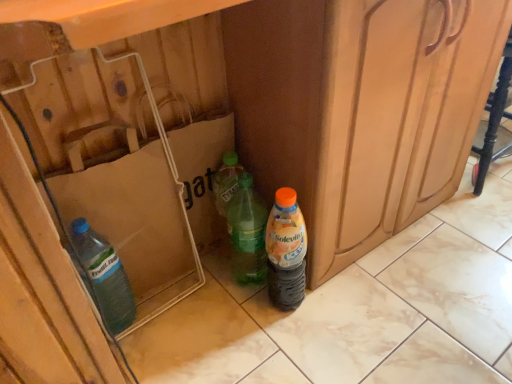
What is the approximate width of orange matte plastic bottle at lower right, marked as the first bottle in a right-to-left arrangement?

orange matte plastic bottle at lower right, marked as the first bottle in a right-to-left arrangement, is 3.39 inches in width.

Where is `orange matte plastic bottle at lower right, which is the second bottle from left to right`? orange matte plastic bottle at lower right, which is the second bottle from left to right is located at coordinates (286, 251).

This screenshot has height=384, width=512. What do you see at coordinates (286, 251) in the screenshot?
I see `orange matte plastic bottle at lower right, which is the second bottle from left to right` at bounding box center [286, 251].

What do you see at coordinates (247, 232) in the screenshot? This screenshot has height=384, width=512. I see `green translucent bottle at center, the 1th bottle from the left` at bounding box center [247, 232].

Find the location of `green translucent bottle at center, the 1th bottle from the left`. green translucent bottle at center, the 1th bottle from the left is located at coordinates (247, 232).

You are a GUI agent. You are given a task and a screenshot of the screen. Output one action in this format:
    pyautogui.click(x=<x>, y=<y>)
    Task: Click on the orange matte plastic bottle at lower right, marked as the first bottle in a right-to-left arrangement
    The width and height of the screenshot is (512, 384).
    Given the screenshot: What is the action you would take?
    pyautogui.click(x=286, y=251)

Does orange matte plastic bottle at lower right, marked as the first bottle in a right-to-left arrangement, appear on the right side of green translucent bottle at center, positioned as the 2th bottle in right-to-left order?

Correct, you'll find orange matte plastic bottle at lower right, marked as the first bottle in a right-to-left arrangement, to the right of green translucent bottle at center, positioned as the 2th bottle in right-to-left order.

Is orange matte plastic bottle at lower right, which is the second bottle from left to right, further to camera compared to green translucent bottle at center, positioned as the 2th bottle in right-to-left order?

No.

Which is closer, (295, 206) or (251, 278)?

Point (295, 206)

From the image's perspective, which one is positioned lower, orange matte plastic bottle at lower right, which is the second bottle from left to right, or green translucent bottle at center, positioned as the 2th bottle in right-to-left order?

orange matte plastic bottle at lower right, which is the second bottle from left to right, from the image's perspective.

From a real-world perspective, relative to green translucent bottle at center, the 1th bottle from the left, is orange matte plastic bottle at lower right, which is the second bottle from left to right, vertically above or below?

In terms of real-world spatial position, orange matte plastic bottle at lower right, which is the second bottle from left to right, is below green translucent bottle at center, the 1th bottle from the left.

Between orange matte plastic bottle at lower right, marked as the first bottle in a right-to-left arrangement, and green translucent bottle at center, positioned as the 2th bottle in right-to-left order, which one has smaller width?

orange matte plastic bottle at lower right, marked as the first bottle in a right-to-left arrangement, is thinner.

Considering the sizes of objects orange matte plastic bottle at lower right, marked as the first bottle in a right-to-left arrangement, and green translucent bottle at center, positioned as the 2th bottle in right-to-left order, in the image provided, who is shorter, orange matte plastic bottle at lower right, marked as the first bottle in a right-to-left arrangement, or green translucent bottle at center, positioned as the 2th bottle in right-to-left order,?

Standing shorter between the two is orange matte plastic bottle at lower right, marked as the first bottle in a right-to-left arrangement.

Which of these two, orange matte plastic bottle at lower right, which is the second bottle from left to right, or green translucent bottle at center, the 1th bottle from the left, is bigger?

green translucent bottle at center, the 1th bottle from the left, is bigger.

Is green translucent bottle at center, the 1th bottle from the left, located within orange matte plastic bottle at lower right, marked as the first bottle in a right-to-left arrangement?

No, green translucent bottle at center, the 1th bottle from the left, is not a part of orange matte plastic bottle at lower right, marked as the first bottle in a right-to-left arrangement.

Is orange matte plastic bottle at lower right, marked as the first bottle in a right-to-left arrangement, next to green translucent bottle at center, the 1th bottle from the left?

Yes, orange matte plastic bottle at lower right, marked as the first bottle in a right-to-left arrangement, is next to green translucent bottle at center, the 1th bottle from the left.

Is orange matte plastic bottle at lower right, marked as the first bottle in a right-to-left arrangement, aimed at green translucent bottle at center, the 1th bottle from the left?

No, orange matte plastic bottle at lower right, marked as the first bottle in a right-to-left arrangement, is not turned towards green translucent bottle at center, the 1th bottle from the left.

Identify the location of bottle on the left of orange matte plastic bottle at lower right, marked as the first bottle in a right-to-left arrangement. (247, 232).

Based on their positions, is green translucent bottle at center, positioned as the 2th bottle in right-to-left order, located to the left or right of orange matte plastic bottle at lower right, which is the second bottle from left to right?

Based on their positions, green translucent bottle at center, positioned as the 2th bottle in right-to-left order, is located to the left of orange matte plastic bottle at lower right, which is the second bottle from left to right.

Is green translucent bottle at center, the 1th bottle from the left, positioned behind orange matte plastic bottle at lower right, which is the second bottle from left to right?

Yes.

Considering the positions of points (241, 267) and (298, 281), is point (241, 267) closer to camera compared to point (298, 281)?

No, (241, 267) is behind (298, 281).

From the image's perspective, is green translucent bottle at center, positioned as the 2th bottle in right-to-left order, positioned above or below orange matte plastic bottle at lower right, which is the second bottle from left to right?

Based on their image positions, green translucent bottle at center, positioned as the 2th bottle in right-to-left order, is located above orange matte plastic bottle at lower right, which is the second bottle from left to right.

From a real-world perspective, relative to orange matte plastic bottle at lower right, which is the second bottle from left to right, is green translucent bottle at center, positioned as the 2th bottle in right-to-left order, vertically above or below?

From a real-world perspective, green translucent bottle at center, positioned as the 2th bottle in right-to-left order, is physically above orange matte plastic bottle at lower right, which is the second bottle from left to right.

Which of these two, green translucent bottle at center, the 1th bottle from the left, or orange matte plastic bottle at lower right, which is the second bottle from left to right, is wider?

green translucent bottle at center, the 1th bottle from the left.

From the picture: Considering the relative sizes of green translucent bottle at center, positioned as the 2th bottle in right-to-left order, and orange matte plastic bottle at lower right, marked as the first bottle in a right-to-left arrangement, in the image provided, is green translucent bottle at center, positioned as the 2th bottle in right-to-left order, taller than orange matte plastic bottle at lower right, marked as the first bottle in a right-to-left arrangement,?

Correct, green translucent bottle at center, positioned as the 2th bottle in right-to-left order, is much taller as orange matte plastic bottle at lower right, marked as the first bottle in a right-to-left arrangement.

Considering the sizes of objects green translucent bottle at center, positioned as the 2th bottle in right-to-left order, and orange matte plastic bottle at lower right, marked as the first bottle in a right-to-left arrangement, in the image provided, who is bigger, green translucent bottle at center, positioned as the 2th bottle in right-to-left order, or orange matte plastic bottle at lower right, marked as the first bottle in a right-to-left arrangement,?

green translucent bottle at center, positioned as the 2th bottle in right-to-left order.

Is green translucent bottle at center, positioned as the 2th bottle in right-to-left order, inside the boundaries of orange matte plastic bottle at lower right, marked as the first bottle in a right-to-left arrangement, or outside?

green translucent bottle at center, positioned as the 2th bottle in right-to-left order, is not inside orange matte plastic bottle at lower right, marked as the first bottle in a right-to-left arrangement, it's outside.

Is there a large distance between green translucent bottle at center, positioned as the 2th bottle in right-to-left order, and orange matte plastic bottle at lower right, which is the second bottle from left to right?

Actually, green translucent bottle at center, positioned as the 2th bottle in right-to-left order, and orange matte plastic bottle at lower right, which is the second bottle from left to right, are a little close together.

Is green translucent bottle at center, the 1th bottle from the left, facing away from orange matte plastic bottle at lower right, which is the second bottle from left to right?

No, green translucent bottle at center, the 1th bottle from the left, is not facing away from orange matte plastic bottle at lower right, which is the second bottle from left to right.

Where is `bottle in front of the green translucent bottle at center, positioned as the 2th bottle in right-to-left order`? This screenshot has width=512, height=384. bottle in front of the green translucent bottle at center, positioned as the 2th bottle in right-to-left order is located at coordinates (286, 251).

Identify the location of bottle located above the orange matte plastic bottle at lower right, which is the second bottle from left to right (from a real-world perspective). (247, 232).

I want to click on bottle below the green translucent bottle at center, positioned as the 2th bottle in right-to-left order (from a real-world perspective), so click(286, 251).